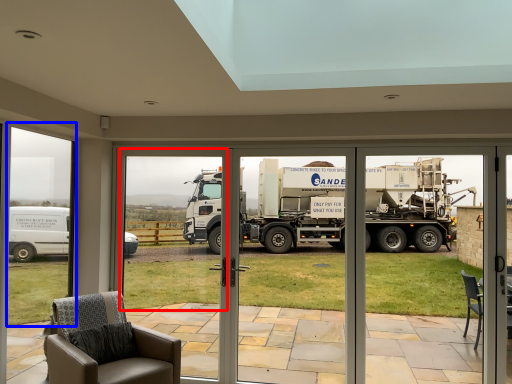
Question: Which of the following is the closest to the observer, window screen (highlighted by a red box) or window frame (highlighted by a blue box)?

Choices:
 (A) window screen
 (B) window frame

Answer: (B)